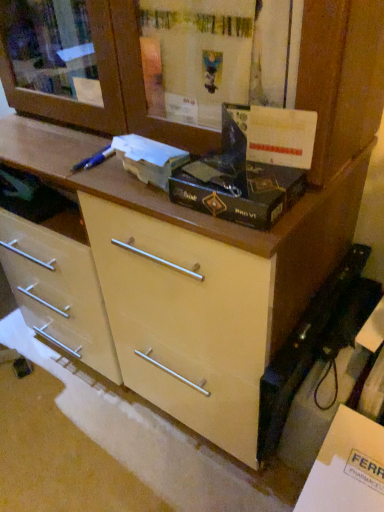
Question: Is white cardboard box at center, acting as the first box starting from the left, taller than black matte box at center, which ranks as the 1th box in right-to-left order?

Choices:
 (A) no
 (B) yes

Answer: (B)

Question: Does white cardboard box at center, acting as the first box starting from the left, turn towards black matte box at center, which ranks as the 1th box in right-to-left order?

Choices:
 (A) yes
 (B) no

Answer: (B)

Question: Is white cardboard box at center, acting as the first box starting from the left, smaller than black matte box at center, which ranks as the 1th box in right-to-left order?

Choices:
 (A) no
 (B) yes

Answer: (B)

Question: Can you confirm if white cardboard box at center, acting as the first box starting from the left, is bigger than black matte box at center, arranged as the 2th box when viewed from the left?

Choices:
 (A) yes
 (B) no

Answer: (B)

Question: Is black matte box at center, arranged as the 2th box when viewed from the left, at the back of white cardboard box at center, acting as the first box starting from the left?

Choices:
 (A) yes
 (B) no

Answer: (B)

Question: Can you confirm if white cardboard box at center, which appears as the second box when viewed from the right, is thinner than black matte box at center, which ranks as the 1th box in right-to-left order?

Choices:
 (A) no
 (B) yes

Answer: (B)

Question: From a real-world perspective, is white matte cabinet at lower right below black matte box at center, arranged as the 2th box when viewed from the left?

Choices:
 (A) no
 (B) yes

Answer: (B)

Question: Is white matte cabinet at lower right aimed at black matte box at center, which ranks as the 1th box in right-to-left order?

Choices:
 (A) yes
 (B) no

Answer: (B)

Question: Does white matte cabinet at lower right have a greater height compared to black matte box at center, which ranks as the 1th box in right-to-left order?

Choices:
 (A) no
 (B) yes

Answer: (B)

Question: Is white matte cabinet at lower right directly adjacent to black matte box at center, which ranks as the 1th box in right-to-left order?

Choices:
 (A) no
 (B) yes

Answer: (A)

Question: Does white matte cabinet at lower right have a greater width compared to black matte box at center, arranged as the 2th box when viewed from the left?

Choices:
 (A) no
 (B) yes

Answer: (B)

Question: Considering the relative sizes of white matte cabinet at lower right and black matte box at center, which ranks as the 1th box in right-to-left order, in the image provided, is white matte cabinet at lower right smaller than black matte box at center, which ranks as the 1th box in right-to-left order,?

Choices:
 (A) no
 (B) yes

Answer: (A)

Question: Is white cardboard box at center, which appears as the second box when viewed from the right, smaller than white matte cabinet at lower right?

Choices:
 (A) no
 (B) yes

Answer: (B)